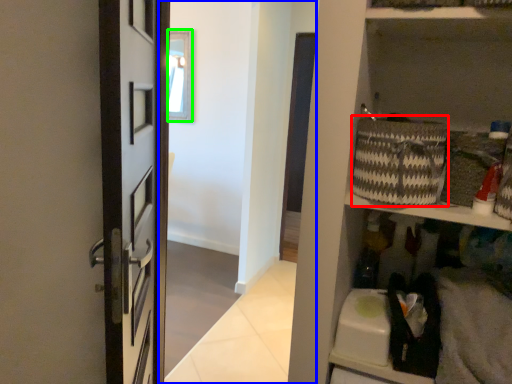
Question: Which object is positioned farthest from basket (highlighted by a red box)? Select from corridor (highlighted by a blue box) and window (highlighted by a green box).

Choices:
 (A) corridor
 (B) window

Answer: (B)